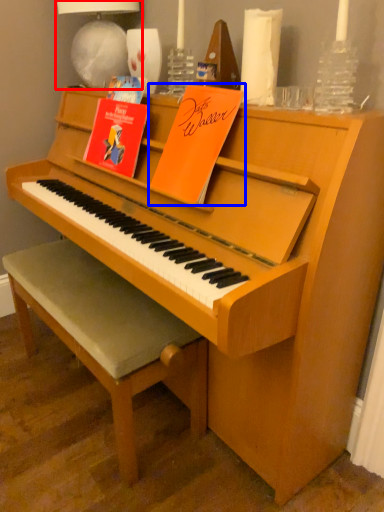
Question: Which object appears farthest to the camera in this image, lamp (highlighted by a red box) or paperback book (highlighted by a blue box)?

Choices:
 (A) lamp
 (B) paperback book

Answer: (A)